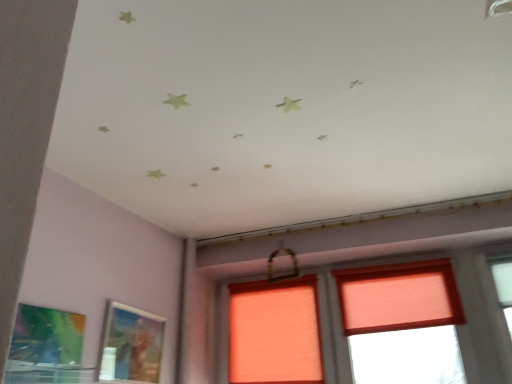
Question: From a real-world perspective, is matte green painting at lower left, which ranks as the 2th picture frame in back-to-front order, located beneath metallic silver picture frame at lower left, marked as the first picture frame in a right-to-left arrangement?

Choices:
 (A) no
 (B) yes

Answer: (B)

Question: Considering the relative sizes of matte green painting at lower left, the first picture frame positioned from the left, and metallic silver picture frame at lower left, positioned as the 2th picture frame in left-to-right order, in the image provided, is matte green painting at lower left, the first picture frame positioned from the left, bigger than metallic silver picture frame at lower left, positioned as the 2th picture frame in left-to-right order,?

Choices:
 (A) yes
 (B) no

Answer: (B)

Question: Can you confirm if matte green painting at lower left, which ranks as the 2th picture frame in back-to-front order, is taller than metallic silver picture frame at lower left, positioned as the 2th picture frame in left-to-right order?

Choices:
 (A) no
 (B) yes

Answer: (B)

Question: Does matte green painting at lower left, the first picture frame in the front-to-back sequence, turn towards metallic silver picture frame at lower left, which ranks as the 2th picture frame in front-to-back order?

Choices:
 (A) no
 (B) yes

Answer: (A)

Question: From the image's perspective, is matte green painting at lower left, which ranks as the 2th picture frame in back-to-front order, located beneath metallic silver picture frame at lower left, marked as the first picture frame in a back-to-front arrangement?

Choices:
 (A) yes
 (B) no

Answer: (B)

Question: Do you think matte green painting at lower left, the first picture frame positioned from the left, is within metallic silver picture frame at lower left, which ranks as the 2th picture frame in front-to-back order, or outside of it?

Choices:
 (A) inside
 (B) outside

Answer: (B)

Question: Considering the positions of matte green painting at lower left, the first picture frame in the front-to-back sequence, and metallic silver picture frame at lower left, positioned as the 2th picture frame in left-to-right order, in the image, is matte green painting at lower left, the first picture frame in the front-to-back sequence, bigger or smaller than metallic silver picture frame at lower left, positioned as the 2th picture frame in left-to-right order,?

Choices:
 (A) big
 (B) small

Answer: (B)

Question: Looking at their shapes, would you say matte green painting at lower left, which ranks as the 2th picture frame in back-to-front order, is wider or thinner than metallic silver picture frame at lower left, marked as the first picture frame in a right-to-left arrangement?

Choices:
 (A) wide
 (B) thin

Answer: (B)

Question: Would you say matte green painting at lower left, which ranks as the 2th picture frame in back-to-front order, is to the left or to the right of metallic silver picture frame at lower left, which ranks as the 2th picture frame in front-to-back order, in the picture?

Choices:
 (A) right
 (B) left

Answer: (B)

Question: Considering the positions of metallic silver picture frame at lower left, marked as the first picture frame in a right-to-left arrangement, and matte green painting at lower left, which is the 2th picture frame from right to left, in the image, is metallic silver picture frame at lower left, marked as the first picture frame in a right-to-left arrangement, bigger or smaller than matte green painting at lower left, which is the 2th picture frame from right to left,?

Choices:
 (A) small
 (B) big

Answer: (B)

Question: Is metallic silver picture frame at lower left, positioned as the 2th picture frame in left-to-right order, wider or thinner than matte green painting at lower left, the first picture frame in the front-to-back sequence?

Choices:
 (A) wide
 (B) thin

Answer: (A)

Question: Relative to matte green painting at lower left, the first picture frame positioned from the left, is metallic silver picture frame at lower left, positioned as the 2th picture frame in left-to-right order, in front or behind?

Choices:
 (A) behind
 (B) front

Answer: (A)

Question: Is point (138, 349) closer or farther from the camera than point (10, 377)?

Choices:
 (A) closer
 (B) farther

Answer: (B)

Question: Considering the positions of orange fabric window at center and metallic silver picture frame at lower left, marked as the first picture frame in a right-to-left arrangement, in the image, is orange fabric window at center wider or thinner than metallic silver picture frame at lower left, marked as the first picture frame in a right-to-left arrangement,?

Choices:
 (A) thin
 (B) wide

Answer: (B)

Question: Is point (442, 322) closer or farther from the camera than point (109, 364)?

Choices:
 (A) closer
 (B) farther

Answer: (B)